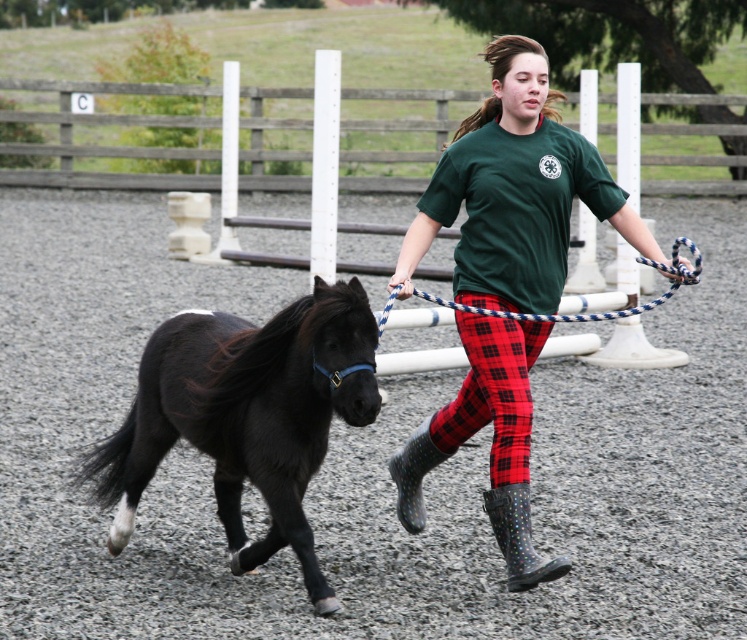
Question: Is green matte shirt at center below rubber dotted boot at lower center?

Choices:
 (A) yes
 (B) no

Answer: (B)

Question: Does black glossy horse at left appear on the right side of blue and white rope at center?

Choices:
 (A) yes
 (B) no

Answer: (B)

Question: Which point is farther to the camera?

Choices:
 (A) gray gravel dirt track at center
 (B) rubber dotted boot at lower center

Answer: (B)

Question: Which point is farther to the camera?

Choices:
 (A) blue and white rope at center
 (B) green matte shirt at center
 (C) black glossy horse at left
 (D) rubber/matte boot at lower center

Answer: (D)

Question: Is gray gravel dirt track at center thinner than black glossy horse at left?

Choices:
 (A) yes
 (B) no

Answer: (B)

Question: Which point is closer to the camera taking this photo?

Choices:
 (A) (427, 445)
 (B) (533, 557)
 (C) (350, 364)

Answer: (C)